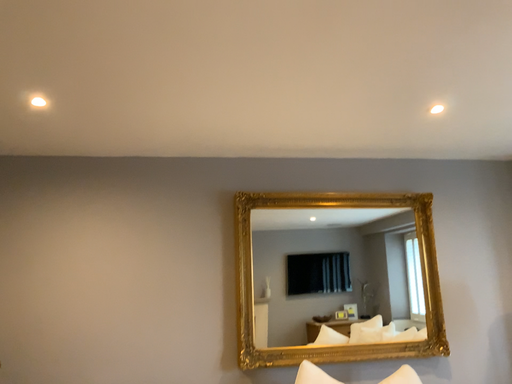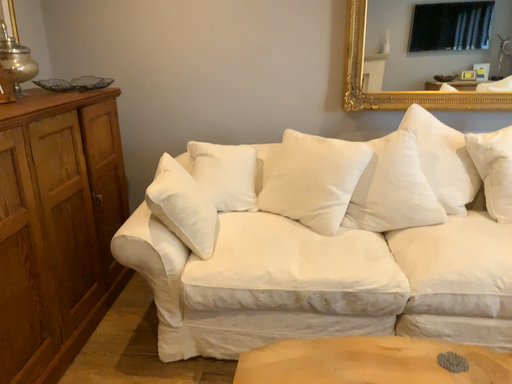
Question: Which way did the camera rotate in the video?

Choices:
 (A) rotated upward
 (B) rotated downward

Answer: (B)